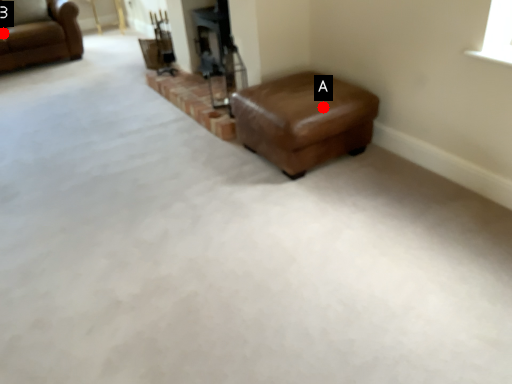
Question: Two points are circled on the image, labeled by A and B beside each circle. Among these points, which one is nearest to the camera?

Choices:
 (A) A is closer
 (B) B is closer

Answer: (A)